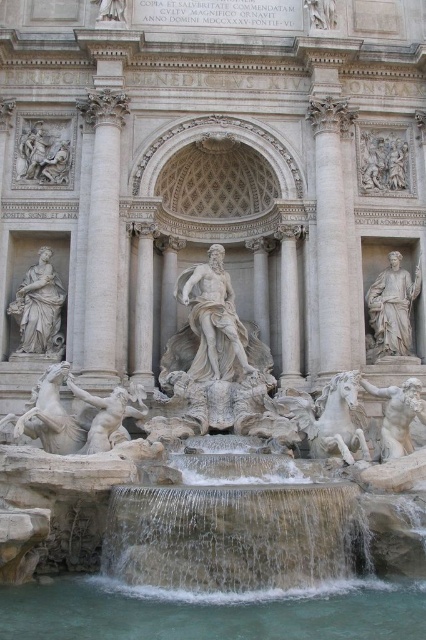
Question: Is white marble statue at left to the left of white marble column at center-left from the viewer's perspective?

Choices:
 (A) yes
 (B) no

Answer: (A)

Question: Which object is farther from the camera taking this photo?

Choices:
 (A) white marble statue at lower left
 (B) white marble column at center
 (C) white marble column at left

Answer: (B)

Question: Which point is closer to the camera taking this photo?

Choices:
 (A) (207, 268)
 (B) (94, 294)
 (C) (342, 195)
 (D) (368, 141)

Answer: (B)

Question: Where is white marble column at upper right located in relation to white marble statue at right in the image?

Choices:
 (A) below
 (B) above

Answer: (B)

Question: Is clear water at lower center wider than white marble statue at lower left?

Choices:
 (A) no
 (B) yes

Answer: (B)

Question: Which point is closer to the camera taking this photo?

Choices:
 (A) (51, 307)
 (B) (299, 369)
 (C) (94, 627)

Answer: (C)